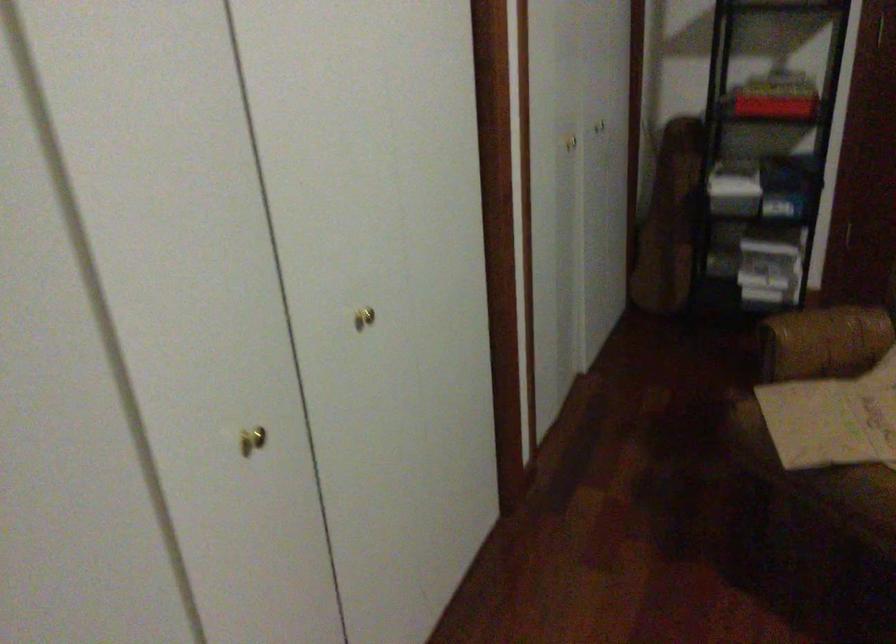
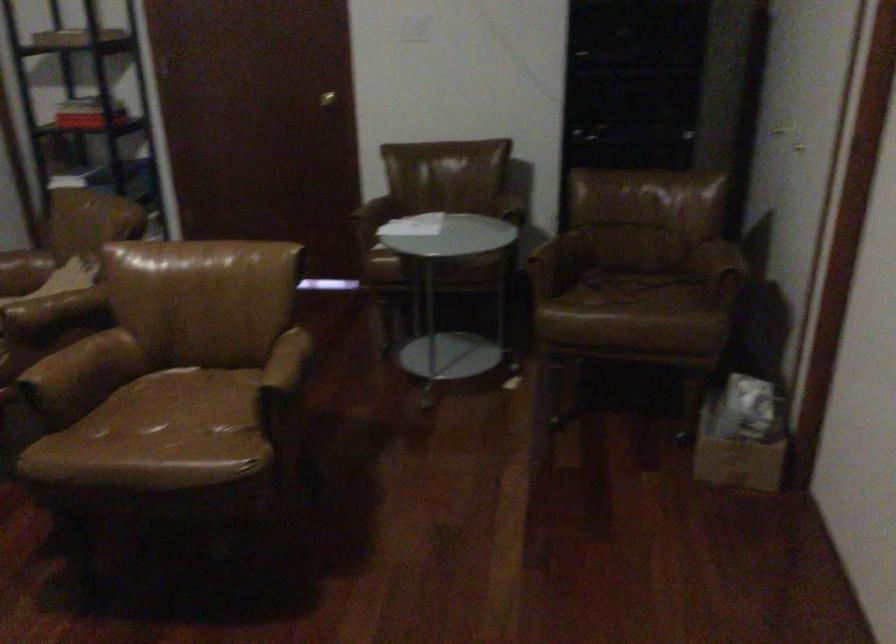
Which direction would the cameraman need to move to produce the second image?

The cameraman moved toward right, backward.